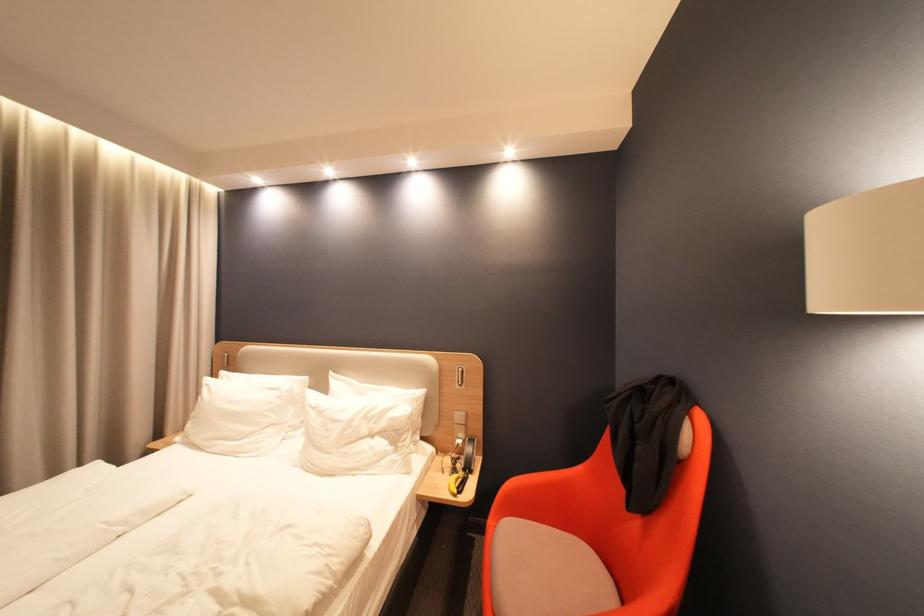
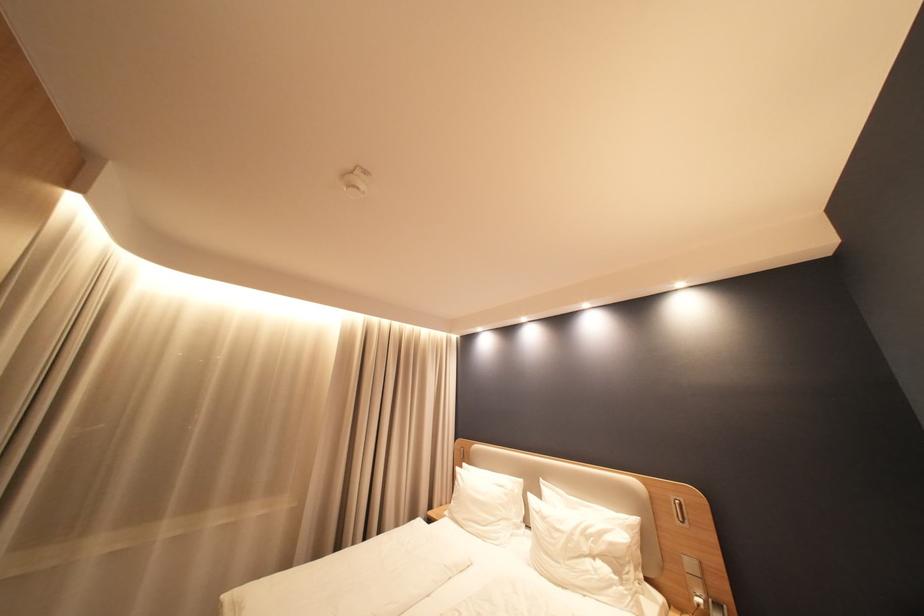
Find the pixel in the second image that matches (467,378) in the first image.

(685, 511)